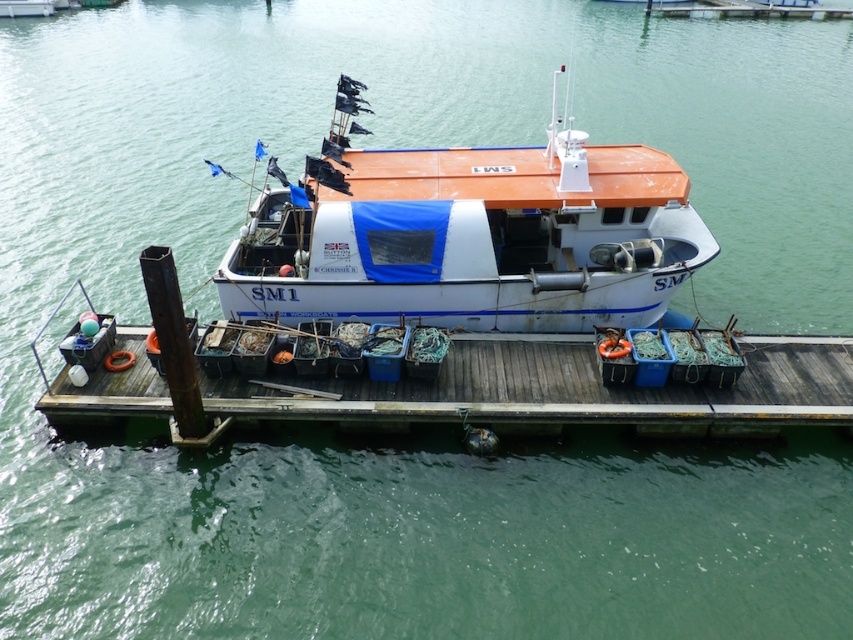
Question: Which point appears farthest from the camera in this image?

Choices:
 (A) (740, 416)
 (B) (598, 232)

Answer: (B)

Question: Does white matte boat at center appear on the left side of wooden dock at center?

Choices:
 (A) no
 (B) yes

Answer: (A)

Question: Can you confirm if white matte boat at center is thinner than wooden dock at center?

Choices:
 (A) no
 (B) yes

Answer: (B)

Question: Which of the following is the farthest from the observer?

Choices:
 (A) (460, 161)
 (B) (795, 378)

Answer: (A)

Question: Is white matte boat at center to the right of wooden dock at center from the viewer's perspective?

Choices:
 (A) yes
 (B) no

Answer: (A)

Question: Which point is farther from the camera taking this photo?

Choices:
 (A) (184, 436)
 (B) (683, 234)

Answer: (B)